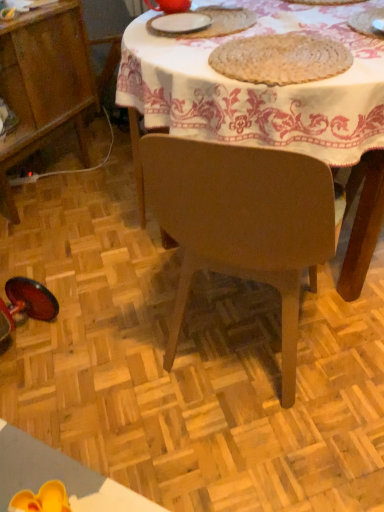
The image size is (384, 512). In order to click on free point to the right of white matte plate at upper center, marked as the 2th tableware in a right-to-left arrangement in this screenshot , I will do `click(244, 25)`.